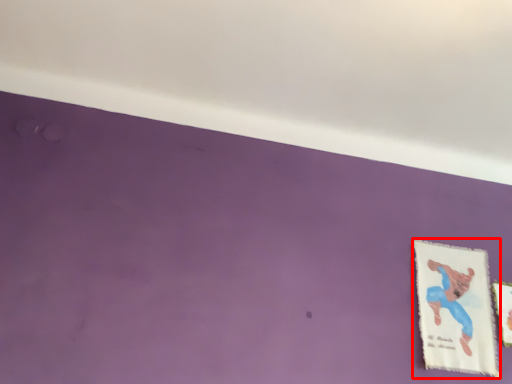
Question: Where is picture frame (annotated by the red box) located in relation to picture frame in the image?

Choices:
 (A) left
 (B) right

Answer: (A)